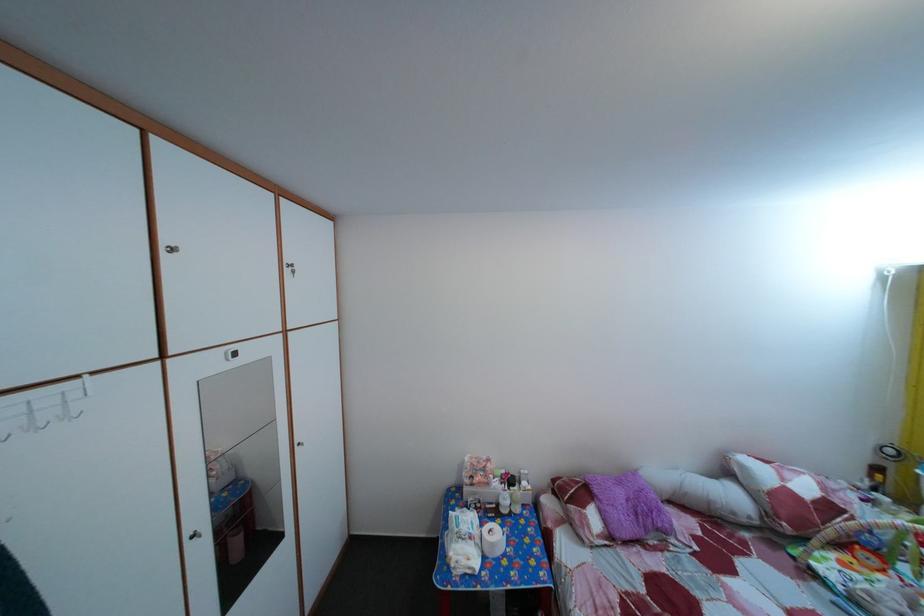
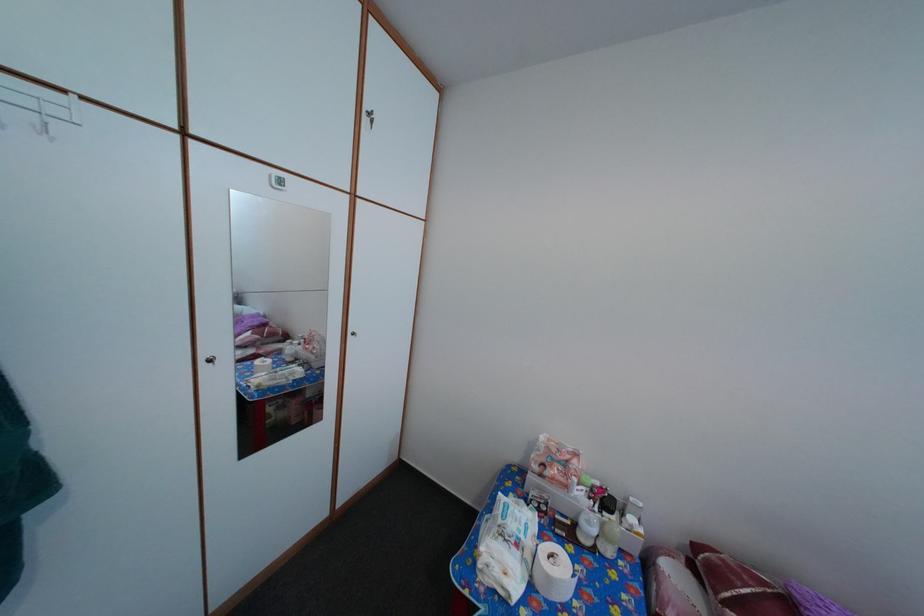
Where in the second image is the point corresponding to point 458,575 from the first image?

(484, 572)